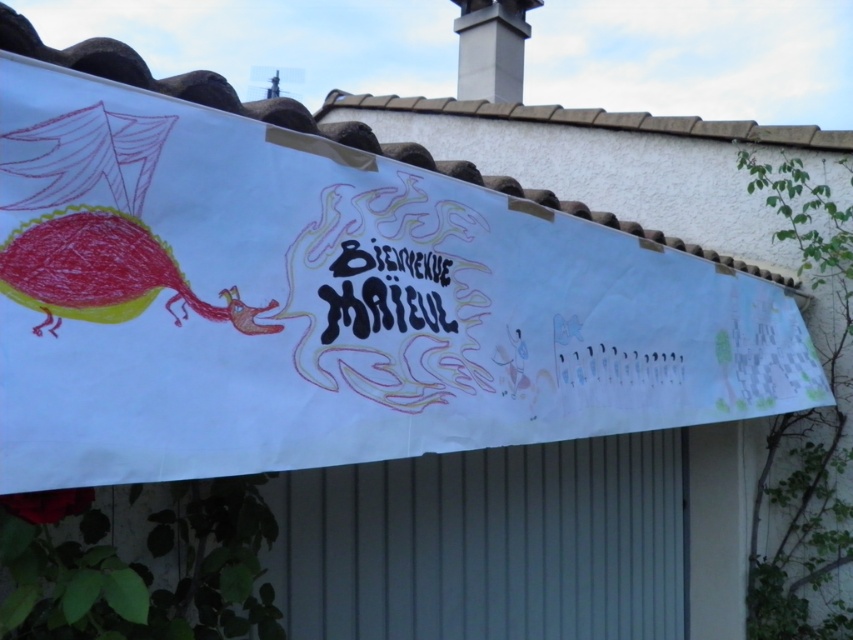
Can you confirm if white paper banner at center is taller than white smooth chimney at upper center?

No, white paper banner at center is not taller than white smooth chimney at upper center.

Between point (473, 186) and point (505, 67), which one is positioned in front?

Positioned in front is point (473, 186).

Between point (170, 444) and point (485, 81), which one is positioned behind?

Positioned behind is point (485, 81).

Find the location of a particular element. The height and width of the screenshot is (640, 853). white paper banner at center is located at coordinates (328, 304).